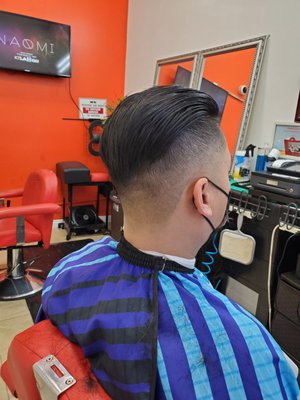
In order to click on base of chair in this screenshot , I will do `click(12, 287)`.